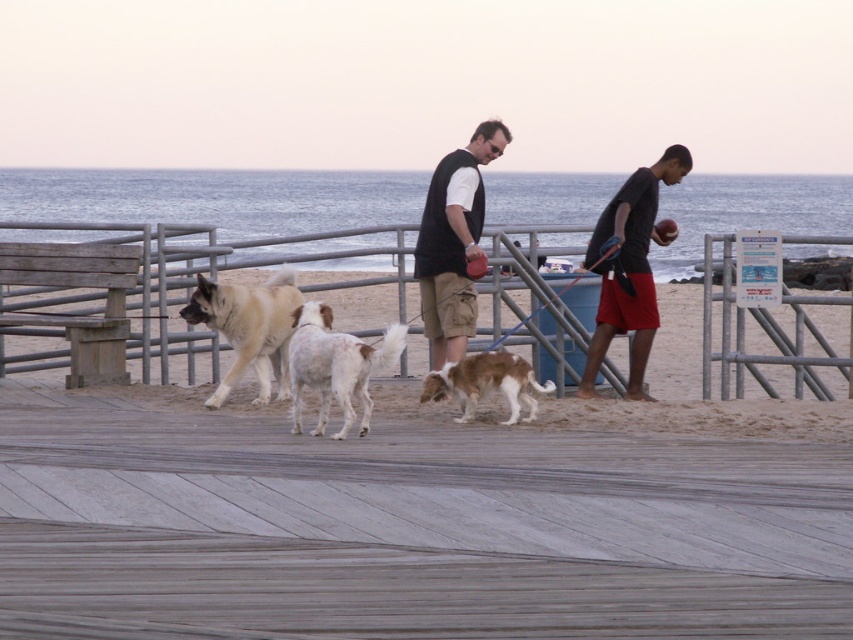
You are a dog owner who wants to ensure your dog can comfortably wear the black vest at center. Since the dog you have is the white speckled fur dog at center, can the vest fit your dog?

The black vest at center has a width that is less than the white speckled fur dog at center, so the vest may be too small to fit the dog comfortably.

You are a photographer standing on the beach and want to take a photo of the brown and white fur at center and the black matte shirt at right. Which one is closer to you?

The black matte shirt at right is closer to you because the brown and white fur at center is behind it.